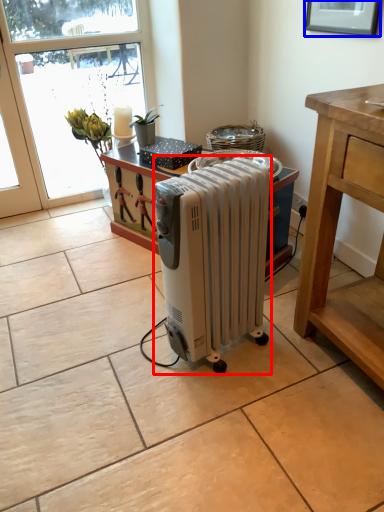
Question: Which object is further to the camera taking this photo, home appliance (highlighted by a red box) or picture frame (highlighted by a blue box)?

Choices:
 (A) home appliance
 (B) picture frame

Answer: (B)